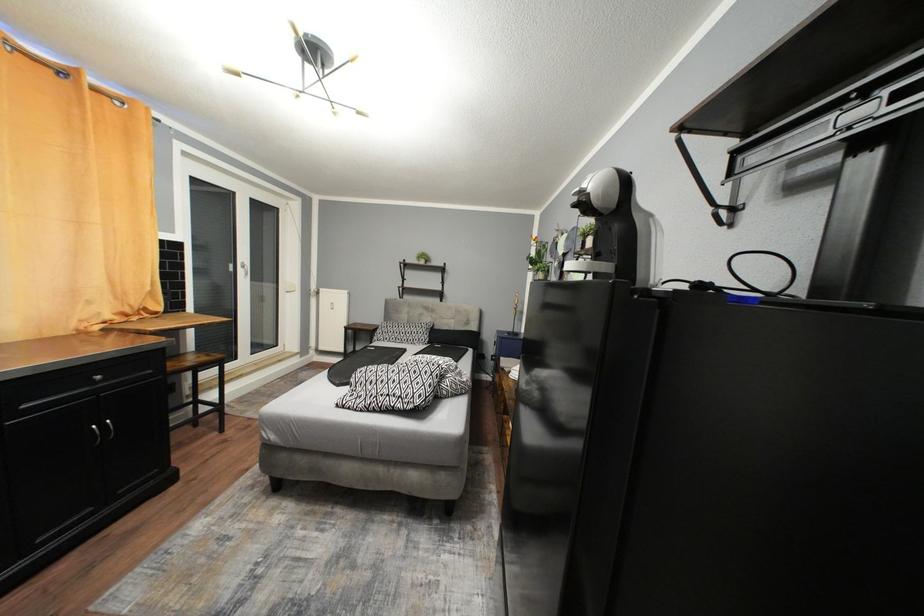
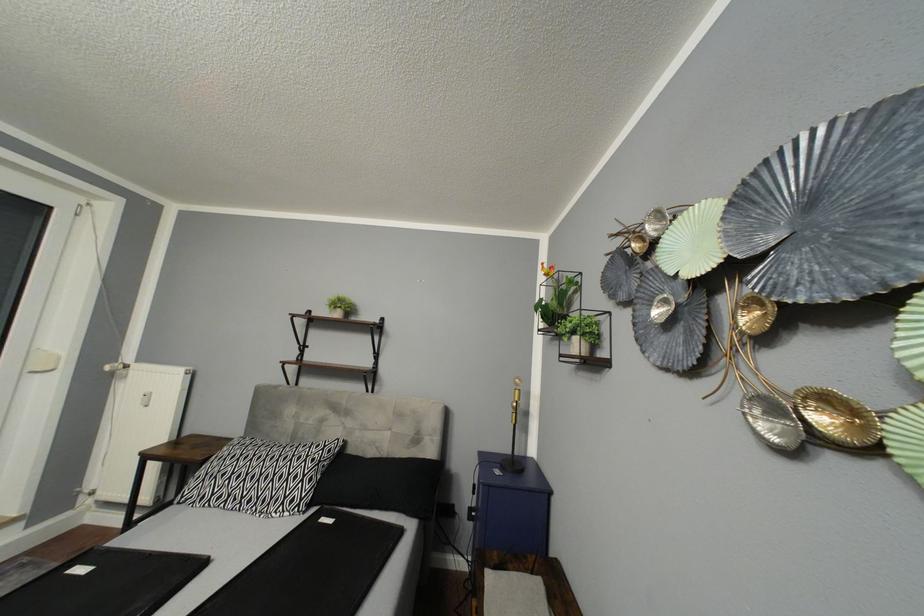
Question: What movement of the cameraman would produce the second image?

Choices:
 (A) Left
 (B) Right
 (C) Forward
 (D) Backward

Answer: (C)